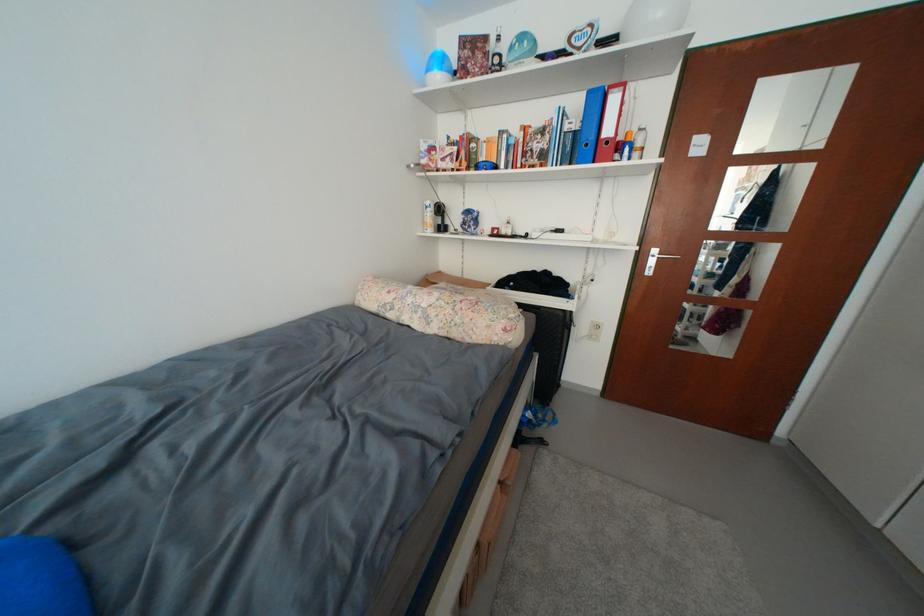
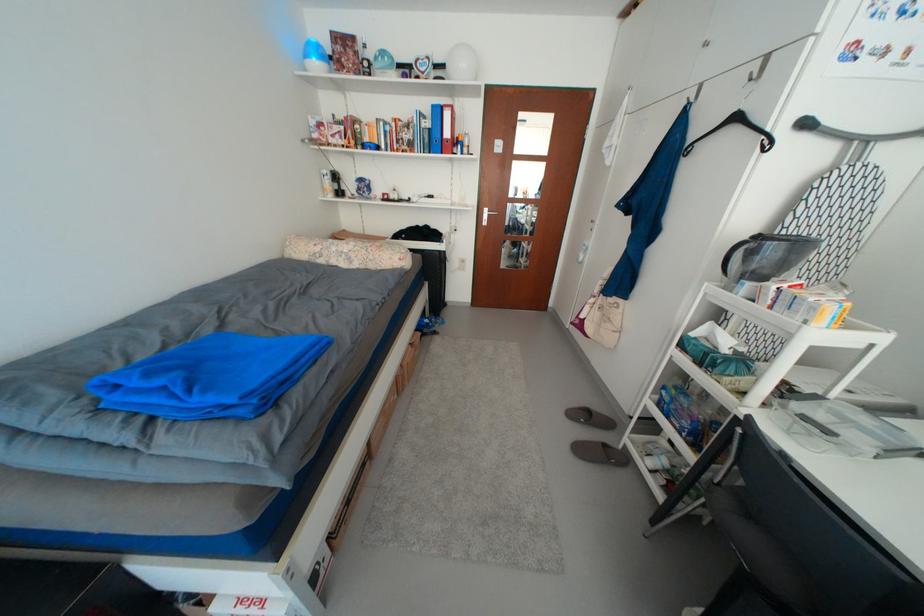
Question: The images are taken continuously from a first-person perspective. In which direction are you moving?

Choices:
 (A) Left
 (B) Right
 (C) Forward
 (D) Backward

Answer: (D)